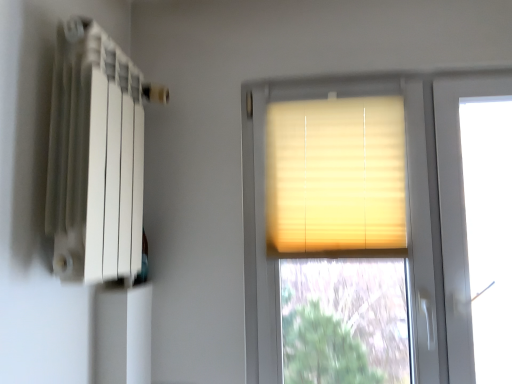
This screenshot has width=512, height=384. I want to click on white matte radiator at left, so click(96, 158).

This screenshot has height=384, width=512. I want to click on beige fabric blinds at center, so click(x=336, y=174).

Where is `white matte radiator at left`? white matte radiator at left is located at coordinates (96, 158).

From a real-world perspective, which object rests below the other?

From a 3D spatial view, matte yellow blinds at center is below.

Which of these two, white matte radiator at left or matte yellow blinds at center, is wider?

With larger width is white matte radiator at left.

Can you tell me how much white matte radiator at left and matte yellow blinds at center differ in facing direction?

The angle between the facing direction of white matte radiator at left and the facing direction of matte yellow blinds at center is 89.3 degrees.

From the image's perspective, is white matte radiator at left on top of matte yellow blinds at center?

Correct, white matte radiator at left appears higher than matte yellow blinds at center in the image.

Consider the image. From a real-world perspective, who is located higher, matte yellow blinds at center or white matte radiator at left?

From a 3D spatial view, white matte radiator at left is above.

Consider the image. Would you say matte yellow blinds at center is inside or outside white matte radiator at left?

matte yellow blinds at center exists outside the volume of white matte radiator at left.

Is matte yellow blinds at center touching white matte radiator at left?

No.

In the scene shown: Who is taller, matte yellow blinds at center or white matte radiator at left?

With more height is matte yellow blinds at center.

Is matte yellow blinds at center facing towards beige fabric blinds at center?

Yes.

Is beige fabric blinds at center located within matte yellow blinds at center?

That's correct, beige fabric blinds at center is inside matte yellow blinds at center.

Locate an element on the screen. window blind on the left of matte yellow blinds at center is located at coordinates (336, 174).

In the scene shown: Considering the sizes of objects beige fabric blinds at center and white matte radiator at left in the image provided, who is taller, beige fabric blinds at center or white matte radiator at left?

Standing taller between the two is white matte radiator at left.

Between beige fabric blinds at center and white matte radiator at left, which one has smaller size?

beige fabric blinds at center is smaller.

Is beige fabric blinds at center outside of white matte radiator at left?

Indeed, beige fabric blinds at center is completely outside white matte radiator at left.

Which is nearer, (319, 111) or (67, 146)?

The point (67, 146) is closer to the camera.

How different are the orientations of beige fabric blinds at center and matte yellow blinds at center in degrees?

The angle between the facing direction of beige fabric blinds at center and the facing direction of matte yellow blinds at center is 0.00462 degrees.

Does beige fabric blinds at center appear on the right side of matte yellow blinds at center?

No.

This screenshot has width=512, height=384. Identify the location of window blind that is above the matte yellow blinds at center (from the image's perspective). (336, 174).

Is beige fabric blinds at center facing away from matte yellow blinds at center?

Yes, beige fabric blinds at center's orientation is away from matte yellow blinds at center.

Is white matte radiator at left in contact with beige fabric blinds at center?

No, white matte radiator at left is not touching beige fabric blinds at center.

Between white matte radiator at left and beige fabric blinds at center, which one has more height?

white matte radiator at left is taller.

Who is more distant, white matte radiator at left or beige fabric blinds at center?

beige fabric blinds at center is behind.

Based on the photo, how different are the orientations of white matte radiator at left and beige fabric blinds at center in degrees?

white matte radiator at left and beige fabric blinds at center are facing 89.3 degrees away from each other.

The height and width of the screenshot is (384, 512). Find the location of `window beneath the white matte radiator at left (from a real-world perspective)`. window beneath the white matte radiator at left (from a real-world perspective) is located at coordinates (400, 215).

At what (x,y) coordinates should I click in order to perform the action: click on radiator in front of the matte yellow blinds at center. Please return your answer as a coordinate pair (x, y). Looking at the image, I should click on (96, 158).

Estimate the real-world distances between objects in this image. Which object is closer to matte yellow blinds at center, beige fabric blinds at center or white matte radiator at left?

Among the two, beige fabric blinds at center is located nearer to matte yellow blinds at center.

When comparing their distances from beige fabric blinds at center, does white matte radiator at left or matte yellow blinds at center seem closer?

matte yellow blinds at center lies closer to beige fabric blinds at center than the other object.

Considering their positions, is white matte radiator at left positioned further to matte yellow blinds at center than beige fabric blinds at center?

white matte radiator at left is further to matte yellow blinds at center.

Based on the photo, from the image, which object appears to be nearer to white matte radiator at left, matte yellow blinds at center or beige fabric blinds at center?

Based on the image, beige fabric blinds at center appears to be nearer to white matte radiator at left.

From the image, which object appears to be farther from beige fabric blinds at center, matte yellow blinds at center or white matte radiator at left?

Among the two, white matte radiator at left is located further to beige fabric blinds at center.

Looking at the image, which one is located closer to white matte radiator at left, beige fabric blinds at center or matte yellow blinds at center?

Based on the image, beige fabric blinds at center appears to be nearer to white matte radiator at left.

This screenshot has width=512, height=384. I want to click on window blind located between white matte radiator at left and matte yellow blinds at center in the left-right direction, so point(336,174).